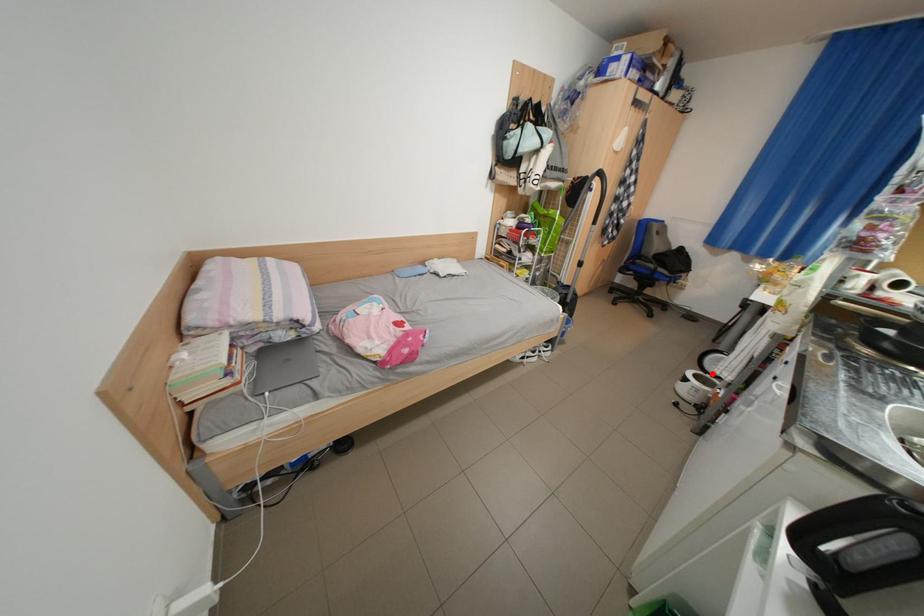
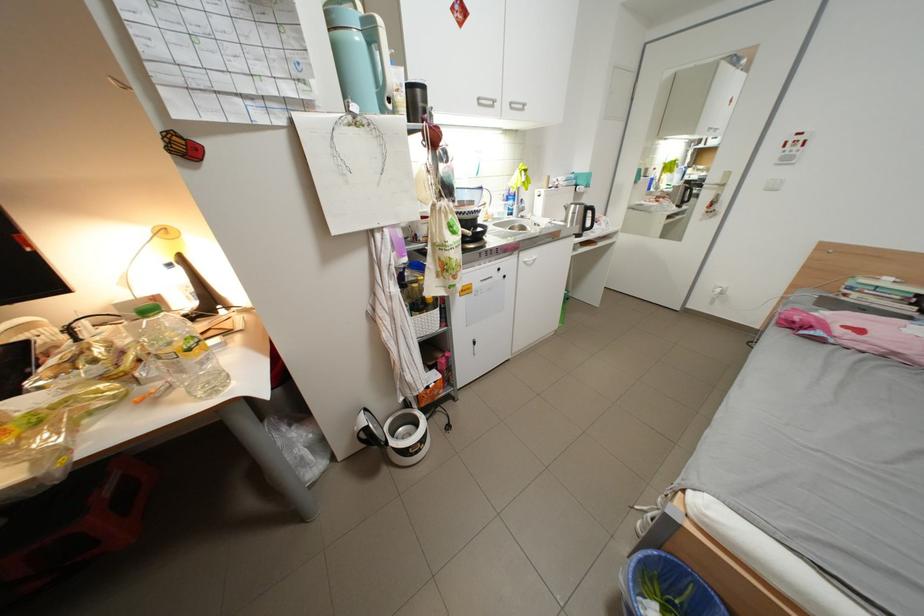
In the second image, find the point that corresponds to the highlighted location in the first image.

(404, 444)